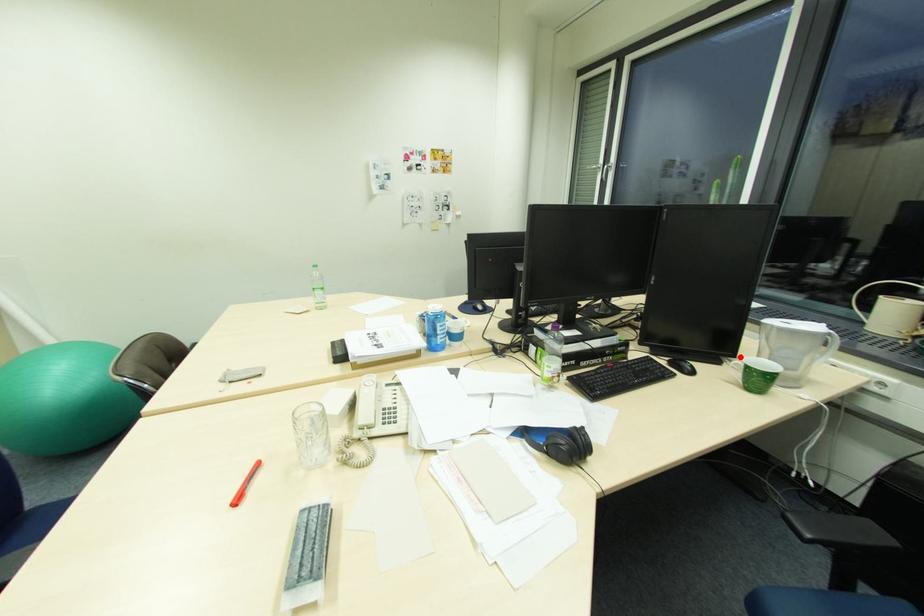
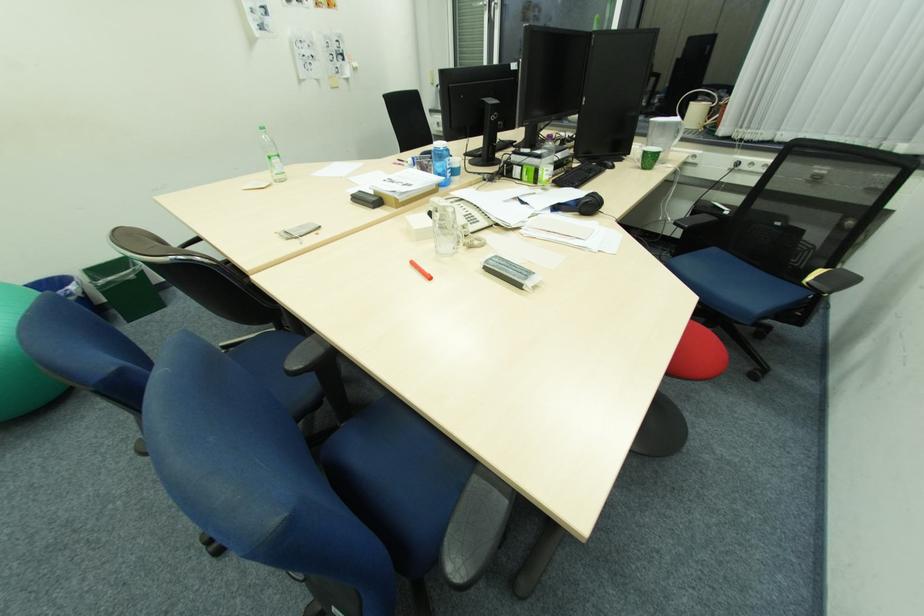
The point at the highlighted location is marked in the first image. Where is the corresponding point in the second image?

(635, 155)